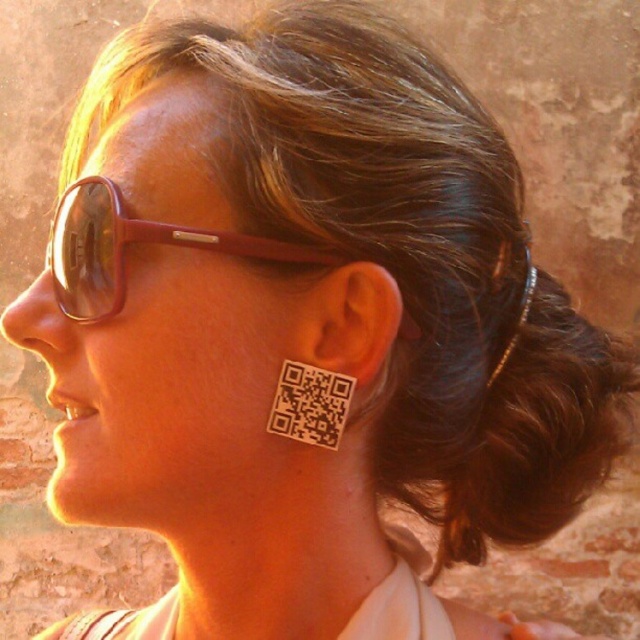
Is point (109, 204) in front of point (330, 294)?

No, (109, 204) is further to viewer.

Which is below, matte brown goggles at upper left or white matte qr code at ear?

Positioned lower is white matte qr code at ear.

Identify the location of matte brown goggles at upper left. pyautogui.click(x=129, y=243).